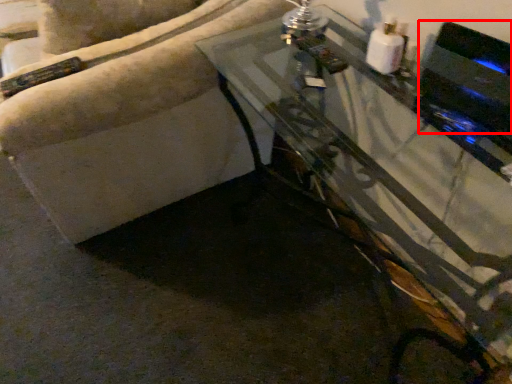
Question: Where is appliance (annotated by the red box) located in relation to table in the image?

Choices:
 (A) right
 (B) left

Answer: (A)